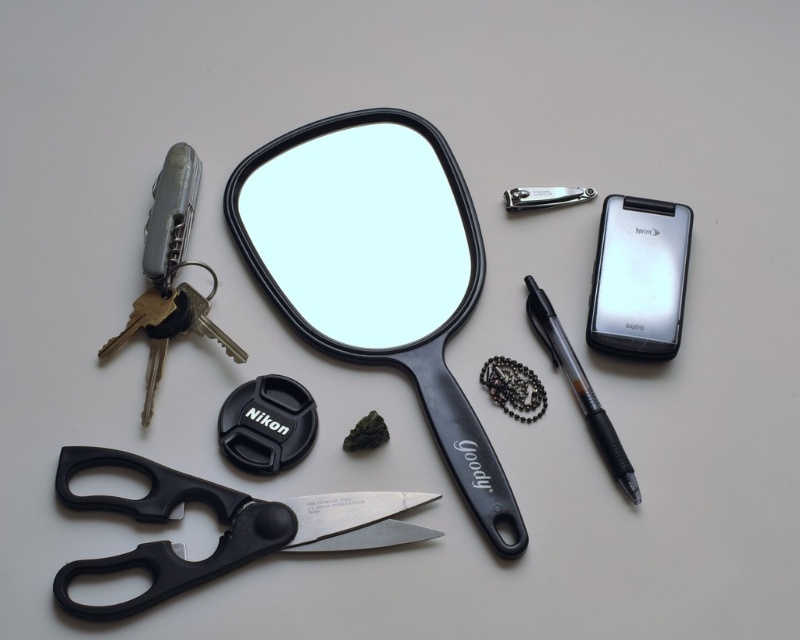
Describe the element at coordinates (224, 524) in the screenshot. I see `black plastic scissors at lower left` at that location.

Is black plastic scissors at lower left thinner than silver metallic multi-tool at left?

No.

Identify the location of black plastic scissors at lower left. (224, 524).

Is black plastic view mirror at center to the right of silver metallic multi-tool at left from the viewer's perspective?

Correct, you'll find black plastic view mirror at center to the right of silver metallic multi-tool at left.

Does point (449, 452) come farther from viewer compared to point (148, 417)?

Yes, point (449, 452) is behind point (148, 417).

Measure the distance between point (404, 244) and camera.

Point (404, 244) is 1.34 meters away from camera.

This screenshot has width=800, height=640. What are the coordinates of `black plastic view mirror at center` in the screenshot? It's located at (377, 269).

Is point (405, 257) more distant than point (550, 348)?

Yes, it is.

Does black plastic mirror at center come in front of black matte pen at right?

No, it is not.

Who is more forward, (304,266) or (554,323)?

Point (554,323)

The height and width of the screenshot is (640, 800). In order to click on black plastic mirror at center in this screenshot , I will do `click(358, 230)`.